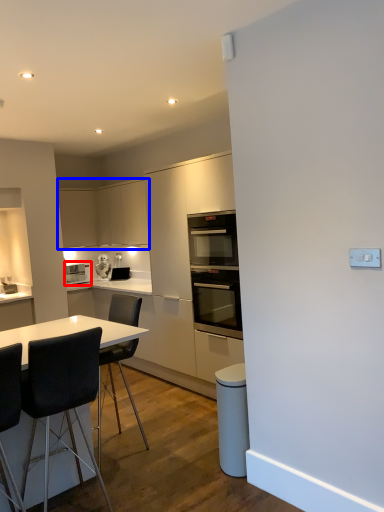
Question: Among these objects, which one is nearest to the camera, home appliance (highlighted by a red box) or cabinetry (highlighted by a blue box)?

Choices:
 (A) home appliance
 (B) cabinetry

Answer: (B)